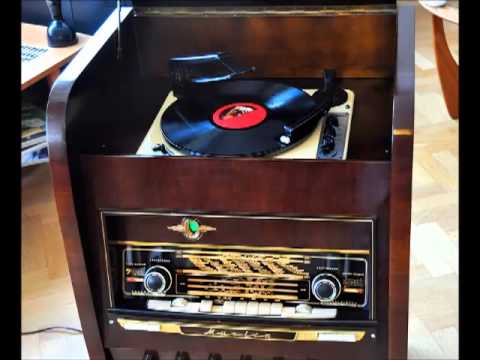
At what (x,y) coordinates should I click in order to perform the action: click on turntable. Please return your answer as a coordinate pair (x, y). Looking at the image, I should click on (278, 151).